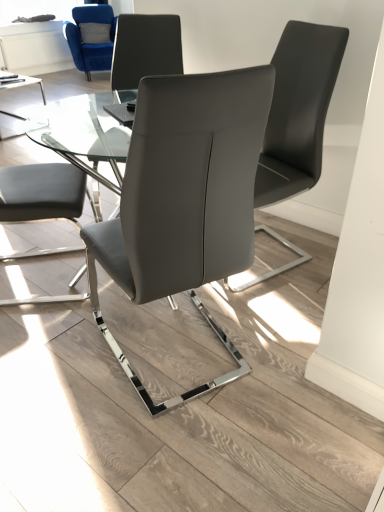
This screenshot has width=384, height=512. Identify the location of free spot in front of transparent glass table at center. (152, 407).